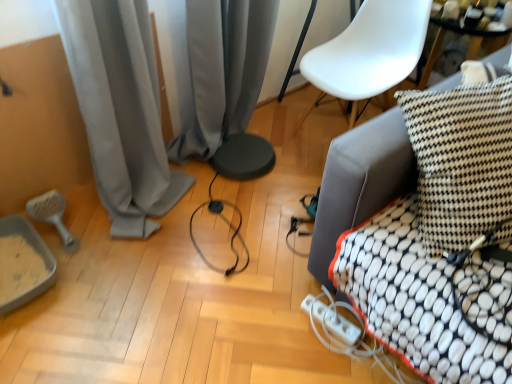
The image size is (512, 384). Find the location of `free point above gray matte brush at lower left (from a real-world perspective)`. free point above gray matte brush at lower left (from a real-world perspective) is located at coordinates (50, 212).